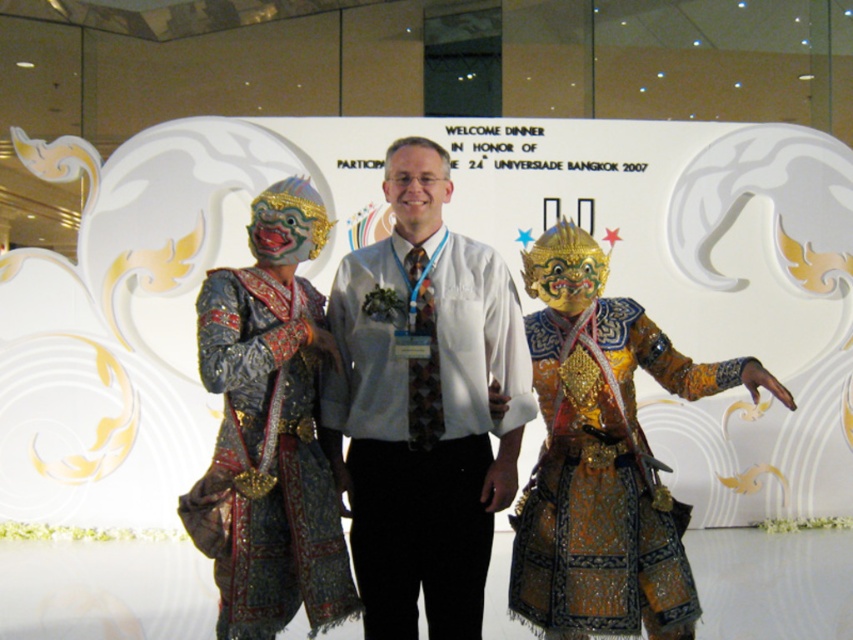
Question: Does white shirt at center appear over shiny metallic robe at left?

Choices:
 (A) no
 (B) yes

Answer: (B)

Question: Which object is farther from the camera taking this photo?

Choices:
 (A) gold metallic mask at center
 (B) matte white shirt at center
 (C) white shirt at center

Answer: (A)

Question: Can you confirm if metallic fabric costumes at center is wider than white shirt at center?

Choices:
 (A) yes
 (B) no

Answer: (A)

Question: Can you confirm if metallic fabric costumes at center is positioned above matte white shirt at center?

Choices:
 (A) yes
 (B) no

Answer: (B)

Question: Which point appears closest to the camera in this image?

Choices:
 (A) (293, 506)
 (B) (399, 189)
 (C) (775, 388)

Answer: (A)

Question: Which is nearer to the gold metallic mask at center?

Choices:
 (A) metallic gold mask at center
 (B) gold sequined robe at center
 (C) white shirt at center
 (D) matte white shirt at center

Answer: (B)